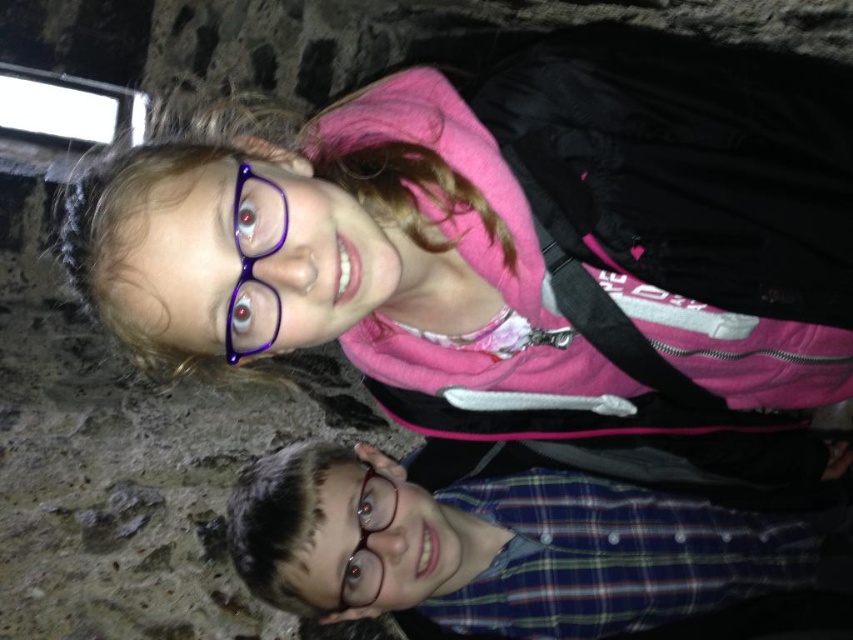
You are a photographer trying to capture a photo of both the plaid fabric shirt at lower right and the purple plastic glasses at upper center in the scene. Given that your camera has a maximum focus range of 25 inches, will you be able to capture both objects clearly in the same frame?

The plaid fabric shirt at lower right and the purple plastic glasses at upper center are 24.88 inches apart from each other. Since the distance between them is within the camera maximum focus range of 25 inches, you can capture both objects clearly in the same frame.

You are standing in a cave with two points marked in the image. The first point is at coordinates point (589, 93) and the second is at point (460, 484). Which point is closer to you?

Point (589, 93) is closer to the viewer than point (460, 484).

You are a photographer setting up for a group photo. You notice the matte pink jacket at upper center and the purple plastic glasses at upper center in the frame. Which object is taller in the image?

The matte pink jacket at upper center is taller than the purple plastic glasses at upper center according to the description.